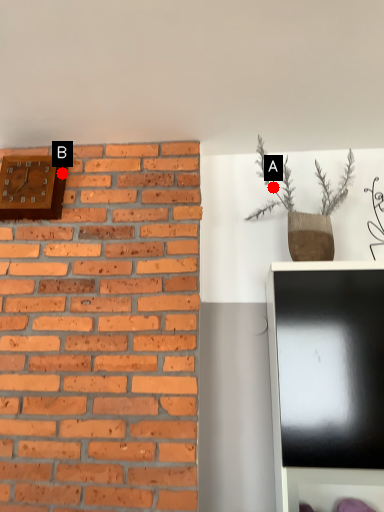
Question: Two points are circled on the image, labeled by A and B beside each circle. Which point is closer to the camera taking this photo?

Choices:
 (A) A is closer
 (B) B is closer

Answer: (B)